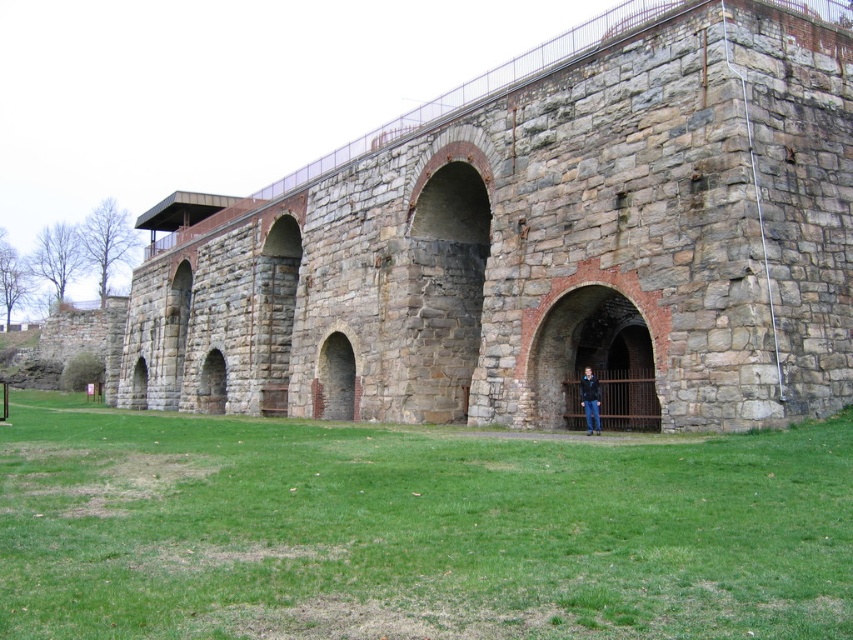
You are a park visitor standing in front of the old stone structure. You see the green grass at lower center and the blue denim jacket at lower center. Which object is closer to the ground?

The green grass at lower center is closer to the ground since it is positioned below the blue denim jacket at lower center.

You are standing in front of the stone structure and want to walk from point A to point B. Point A is at coordinate point(x=567, y=49) and point B is at coordinate point(x=590, y=433). Which point is closer to you when you first arrive at the scene?

Point A at coordinate point(x=567, y=49) is closer to you because it is further to the viewer than point B at coordinate point(x=590, y=433).

You are standing in front of an old stone structure with arches and see both the green grass at lower center and the blue denim jacket at lower center. Which object is positioned to the left of the other?

The green grass at lower center is to the left of the blue denim jacket at lower center.